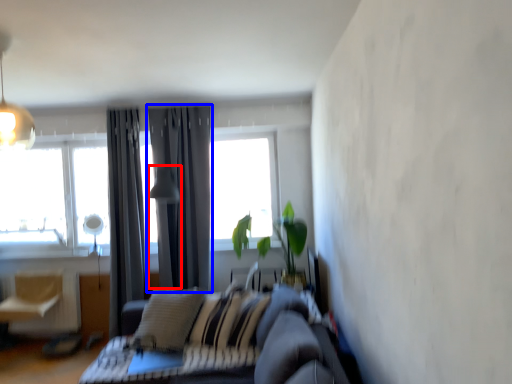
Question: Which of the following is the closest to the observer, light fixture (highlighted by a red box) or curtain (highlighted by a blue box)?

Choices:
 (A) light fixture
 (B) curtain

Answer: (A)